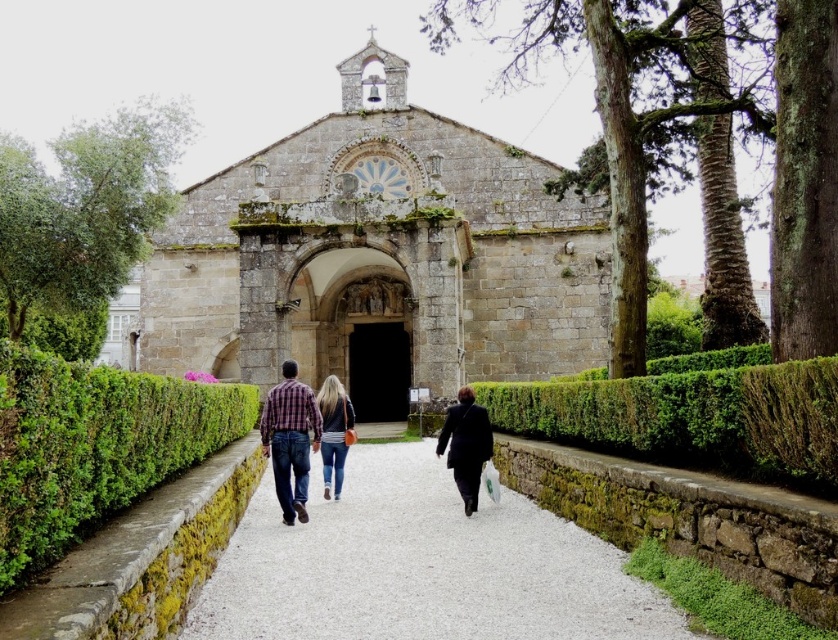
Can you confirm if plaid fabric shirt at center is positioned to the left of dark blue fabric coat at center?

Indeed, plaid fabric shirt at center is positioned on the left side of dark blue fabric coat at center.

The image size is (838, 640). Find the location of `plaid fabric shirt at center`. plaid fabric shirt at center is located at coordinates (290, 440).

Who is more forward, (459, 396) or (340, 449)?

Point (340, 449) is more forward.

The height and width of the screenshot is (640, 838). What are the coordinates of `dark blue fabric coat at center` in the screenshot? It's located at (466, 444).

Which is more to the right, stone church at center or smooth gravel path at center?

Positioned to the right is smooth gravel path at center.

Can you confirm if stone church at center is smaller than smooth gravel path at center?

Incorrect, stone church at center is not smaller in size than smooth gravel path at center.

Locate an element on the screen. stone church at center is located at coordinates (376, 259).